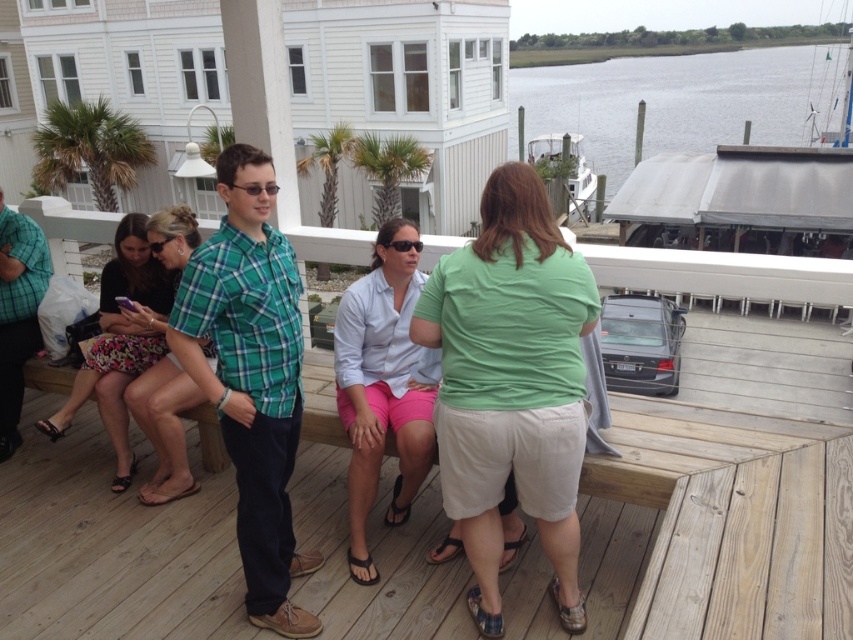
Between point (210, 257) and point (184, 221), which one is positioned in front?

Point (210, 257) is more forward.

Who is lower down, green plaid shirt at center or floral cotton skirt at left?

green plaid shirt at center is below.

Between point (247, 256) and point (180, 474), which one is positioned in front?

Point (247, 256)

Image resolution: width=853 pixels, height=640 pixels. I want to click on green plaid shirt at center, so click(x=251, y=376).

Measure the distance from green plaid shirt at center to floral skirt at lower left.

The distance of green plaid shirt at center from floral skirt at lower left is 1.33 meters.

Is point (225, 323) positioned after point (126, 451)?

No, it is in front of (126, 451).

Locate an element on the screen. green plaid shirt at center is located at coordinates coord(251,376).

From the picture: Which is more to the right, green plaid shirt at center or light blue shirt at center?

light blue shirt at center is more to the right.

Is green plaid shirt at center positioned in front of light blue shirt at center?

Yes, green plaid shirt at center is in front of light blue shirt at center.

Measure the distance between green plaid shirt at center and camera.

green plaid shirt at center and camera are 2.25 meters apart.

Locate an element on the screen. The width and height of the screenshot is (853, 640). green plaid shirt at center is located at coordinates [x=251, y=376].